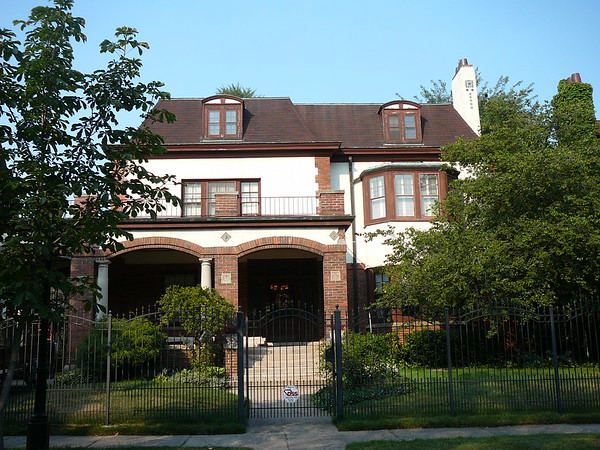
I want to click on windows, so click(414, 117), click(394, 129), click(407, 182), click(437, 186), click(369, 191), click(214, 117), click(231, 122), click(196, 192), click(240, 189).